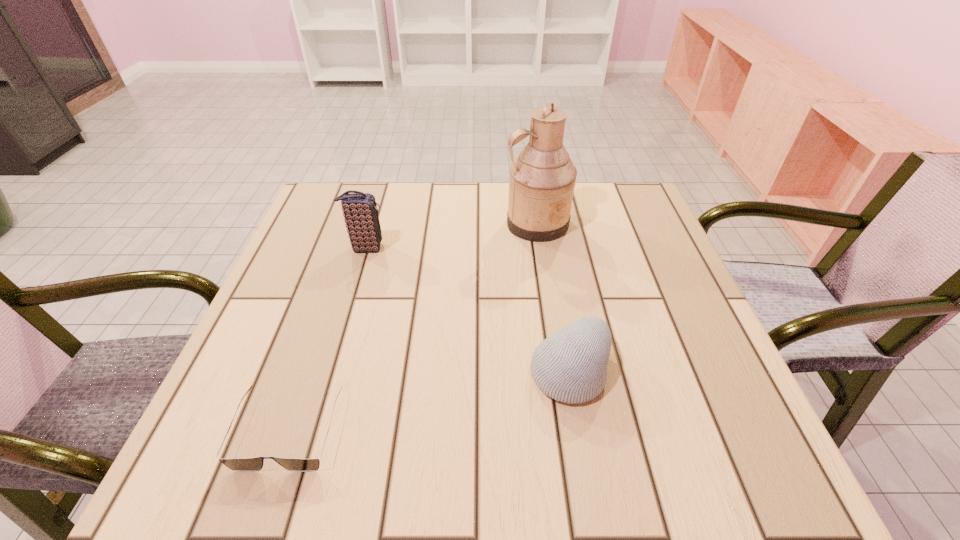
The height and width of the screenshot is (540, 960). In order to click on free region that satisfies the following two spatial constraints: 1. with the zip open on the third tallest object; 2. on the left side of the clutch bag in this screenshot , I will do `click(329, 372)`.

I want to click on vacant space that satisfies the following two spatial constraints: 1. on the front side of the tallest object; 2. with the zip open on the clutch bag, so click(x=540, y=248).

At what (x,y) coordinates should I click in order to perform the action: click on vacant position in the image that satisfies the following two spatial constraints: 1. with the zip open on the clutch bag; 2. on the front-facing side of the sunglasses. Please return your answer as a coordinate pair (x, y). This screenshot has height=540, width=960. Looking at the image, I should click on (312, 429).

Identify the location of free space in the image that satisfies the following two spatial constraints: 1. with the zip open on the clutch bag; 2. on the front-facing side of the sunglasses. The height and width of the screenshot is (540, 960). (312, 429).

Where is `free space that satisfies the following two spatial constraints: 1. with the zip open on the clutch bag; 2. on the front-facing side of the sunglasses`? The image size is (960, 540). free space that satisfies the following two spatial constraints: 1. with the zip open on the clutch bag; 2. on the front-facing side of the sunglasses is located at coordinates (312, 429).

Identify the location of vacant space that satisfies the following two spatial constraints: 1. with the zip open on the clutch bag; 2. on the front-facing side of the shortest object. (312, 429).